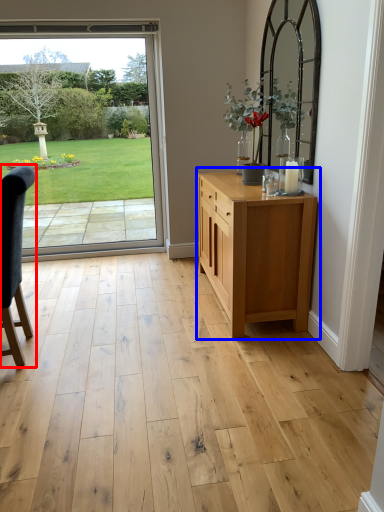
Question: Which object appears closest to the camera in this image, chair (highlighted by a red box) or chest of drawers (highlighted by a blue box)?

Choices:
 (A) chair
 (B) chest of drawers

Answer: (A)